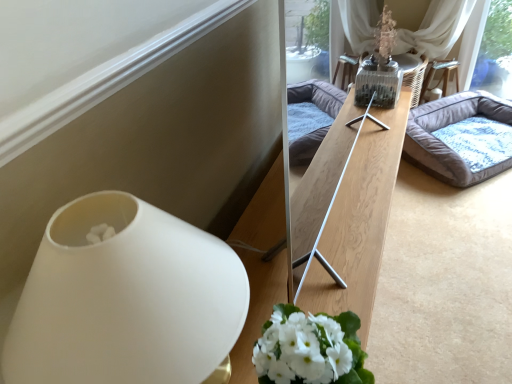
Question: From a real-world perspective, is white matte vase at lower left over gray fabric pet bed at center?

Choices:
 (A) yes
 (B) no

Answer: (A)

Question: Is white matte vase at lower left positioned with its back to gray fabric pet bed at center?

Choices:
 (A) no
 (B) yes

Answer: (A)

Question: From the image's perspective, is white matte vase at lower left on top of gray fabric pet bed at center?

Choices:
 (A) no
 (B) yes

Answer: (A)

Question: Is white matte vase at lower left to the left of gray fabric pet bed at center from the viewer's perspective?

Choices:
 (A) no
 (B) yes

Answer: (B)

Question: Is white matte vase at lower left in front of gray fabric pet bed at center?

Choices:
 (A) yes
 (B) no

Answer: (A)

Question: Can you confirm if white matte vase at lower left is thinner than gray fabric pet bed at center?

Choices:
 (A) yes
 (B) no

Answer: (A)

Question: Does gray fabric pet bed at center touch white matte vase at lower left?

Choices:
 (A) no
 (B) yes

Answer: (A)

Question: Considering the relative sizes of gray fabric pet bed at center and white matte vase at lower left in the image provided, is gray fabric pet bed at center taller than white matte vase at lower left?

Choices:
 (A) no
 (B) yes

Answer: (A)

Question: Is gray fabric pet bed at center at the left side of white matte vase at lower left?

Choices:
 (A) no
 (B) yes

Answer: (A)

Question: Can you confirm if gray fabric pet bed at center is bigger than white matte vase at lower left?

Choices:
 (A) no
 (B) yes

Answer: (B)

Question: Is gray fabric pet bed at center shorter than white matte vase at lower left?

Choices:
 (A) no
 (B) yes

Answer: (B)

Question: Would you say gray fabric pet bed at center is a long distance from white matte vase at lower left?

Choices:
 (A) no
 (B) yes

Answer: (B)

Question: Is gray fabric pet bed at center wider or thinner than white matte vase at lower left?

Choices:
 (A) thin
 (B) wide

Answer: (B)